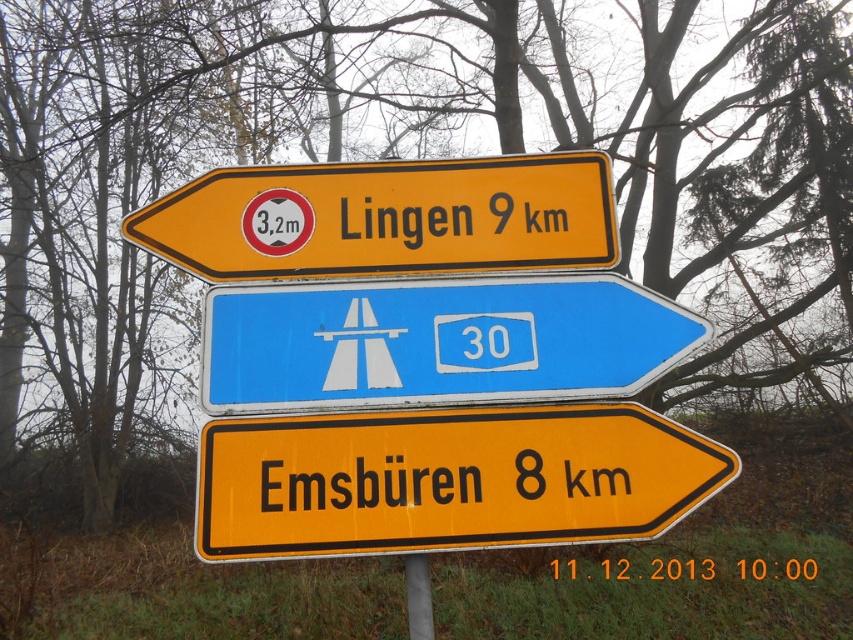
Does blue plastic road sign at center have a smaller size compared to metallic pole at center?

No.

Is blue plastic road sign at center to the right of metallic pole at center from the viewer's perspective?

Correct, you'll find blue plastic road sign at center to the right of metallic pole at center.

What are the coordinates of `blue plastic road sign at center` in the screenshot? It's located at (437, 340).

Does point (320, 339) lie in front of point (306, 179)?

Yes, it is in front of point (306, 179).

Who is higher up, blue plastic road sign at center or yellow plastic sign at upper center?

Positioned higher is yellow plastic sign at upper center.

Is point (616, 324) behind point (498, 196)?

That is False.

At what (x,y) coordinates should I click in order to perform the action: click on blue plastic road sign at center. Please return your answer as a coordinate pair (x, y). Looking at the image, I should click on (437, 340).

Between yellow plastic sign at lower center and yellow plastic sign at upper center, which one has more height?

yellow plastic sign at lower center

Does yellow plastic sign at lower center appear under yellow plastic sign at upper center?

Indeed, yellow plastic sign at lower center is positioned under yellow plastic sign at upper center.

Measure the distance between yellow plastic sign at lower center and camera.

They are 1.92 meters apart.

You are a GUI agent. You are given a task and a screenshot of the screen. Output one action in this format:
    pyautogui.click(x=<x>, y=<y>)
    Task: Click on the yellow plastic sign at lower center
    The height and width of the screenshot is (640, 853).
    Given the screenshot: What is the action you would take?
    pyautogui.click(x=447, y=481)